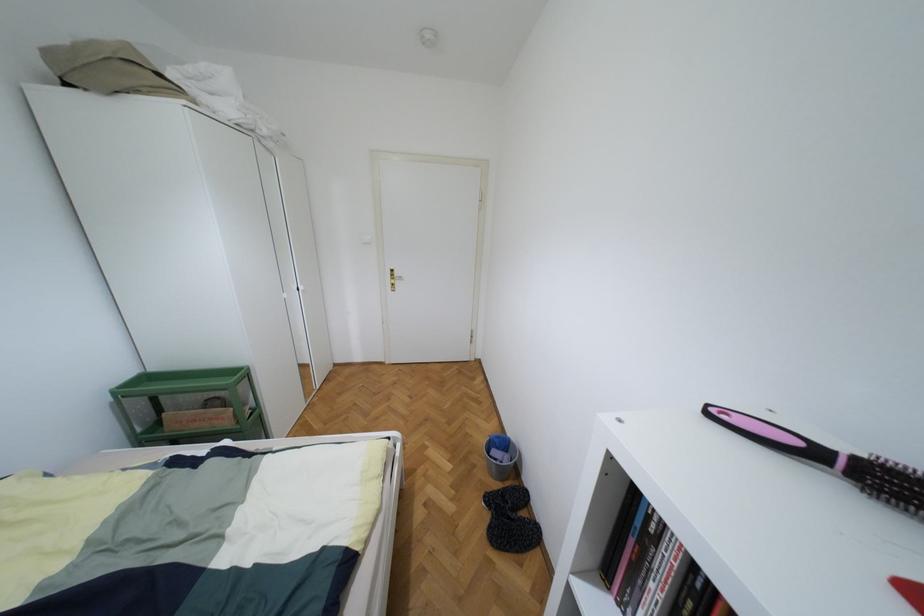
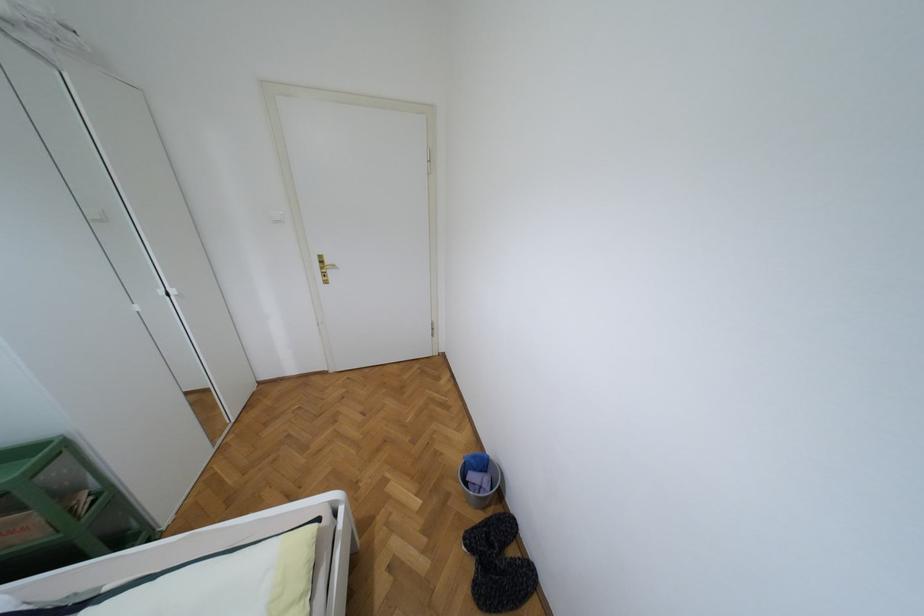
Question: The camera is either moving clockwise (left) or counter-clockwise (right) around the object. The first image is from the beginning of the video and the second image is from the end. Is the camera moving left or right when shooting the video?

Choices:
 (A) Left
 (B) Right

Answer: (A)